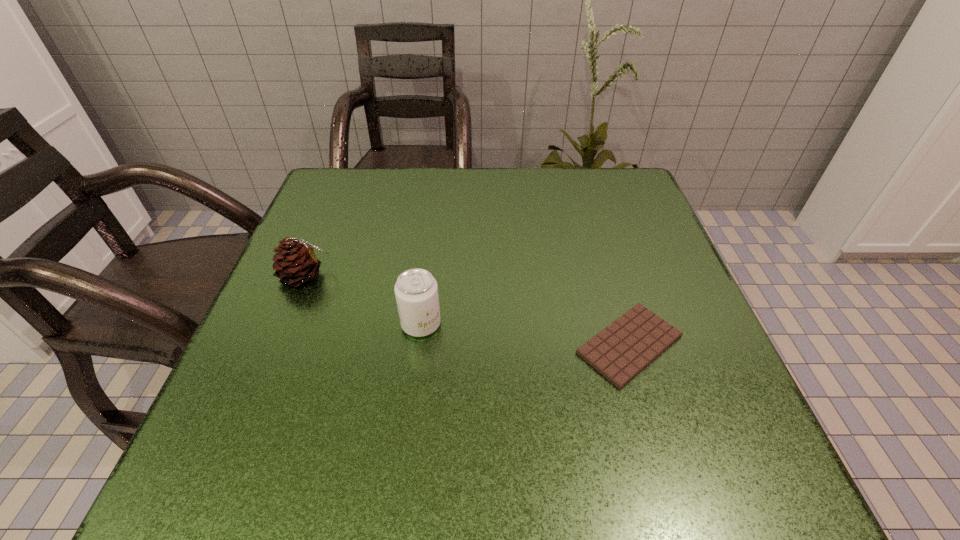
The width and height of the screenshot is (960, 540). In order to click on the second object from right to left in this screenshot , I will do `click(416, 290)`.

Identify the location of the leftmost object. (296, 262).

The image size is (960, 540). Identify the location of pinecone. (296, 262).

At what (x,y) coordinates should I click in order to perform the action: click on chocolate bar. Please return your answer as a coordinate pair (x, y). Looking at the image, I should click on coord(623,349).

You are a GUI agent. You are given a task and a screenshot of the screen. Output one action in this format:
    pyautogui.click(x=<x>, y=<y>)
    Task: Click on the shortest object
    This screenshot has width=960, height=540.
    Given the screenshot: What is the action you would take?
    pyautogui.click(x=623, y=349)

Locate an element on the screen. The height and width of the screenshot is (540, 960). vacant space situated on the back of the soda can is located at coordinates (428, 266).

Locate an element on the screen. This screenshot has width=960, height=540. vacant space located 0.370m with a leaf charm attached to the leftmost object is located at coordinates (516, 276).

This screenshot has height=540, width=960. In order to click on free spot located 0.120m on the back of the shortest object in this screenshot , I will do `click(605, 263)`.

The width and height of the screenshot is (960, 540). Identify the location of object situated at the left edge. click(296, 262).

Find the location of a particular element. The width and height of the screenshot is (960, 540). object that is at the right edge is located at coordinates (623, 349).